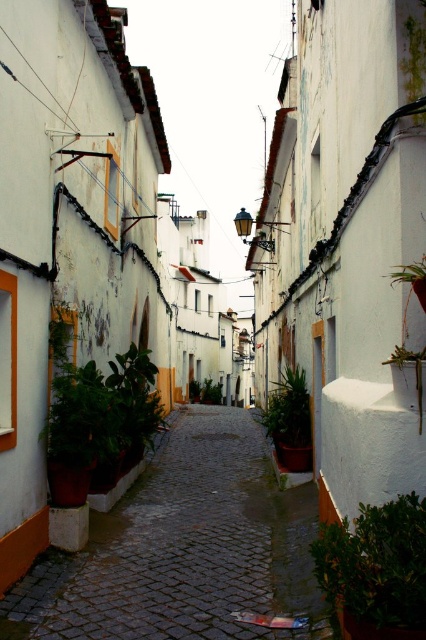
Is green leafy plant at lower right thinner than green leafy plant at center?

Indeed, green leafy plant at lower right has a lesser width compared to green leafy plant at center.

Is green leafy plant at lower right to the left of green leafy plant at center from the viewer's perspective?

No, green leafy plant at lower right is not to the left of green leafy plant at center.

Which is in front, point (362, 596) or point (196, 394)?

Positioned in front is point (362, 596).

Locate an element on the screen. green leafy plant at lower right is located at coordinates (377, 570).

Is smooth cobblestone path at center above green leafy plant at center?

Yes, smooth cobblestone path at center is above green leafy plant at center.

Which of these two, smooth cobblestone path at center or green leafy plant at center, stands taller?

green leafy plant at center is taller.

Which is behind, point (210, 448) or point (190, 392)?

Positioned behind is point (190, 392).

Locate an element on the screen. This screenshot has width=426, height=640. smooth cobblestone path at center is located at coordinates (183, 548).

Is green leafy plant at lower right to the left of green matte plant at center from the viewer's perspective?

Correct, you'll find green leafy plant at lower right to the left of green matte plant at center.

Is point (422, 593) more distant than point (302, 394)?

No, it is in front of (302, 394).

Find the location of a particular element. The image size is (426, 640). green leafy plant at lower right is located at coordinates (377, 570).